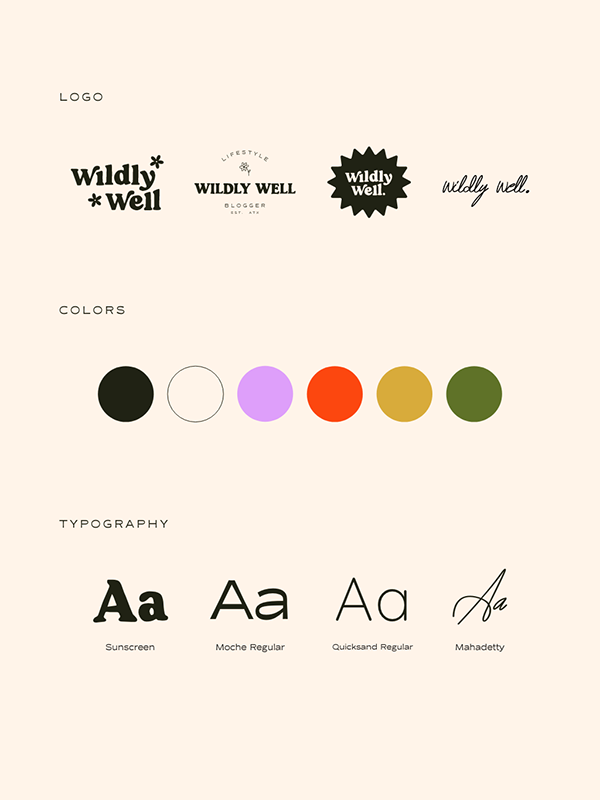
Find the location of a particular element. cream colored background is located at coordinates (541, 730).